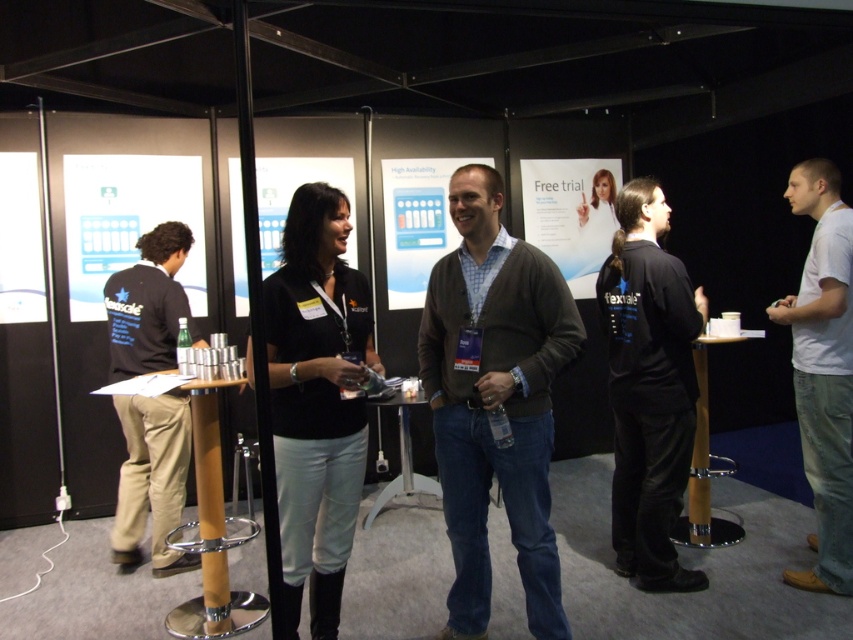
Based on the photo, which is more to the right, matte brown cardigan at center or white cotton shirt at right?

white cotton shirt at right

Can you confirm if matte brown cardigan at center is wider than white cotton shirt at right?

Yes, matte brown cardigan at center is wider than white cotton shirt at right.

Which is behind, point (521, 544) or point (831, 289)?

Point (831, 289)

This screenshot has width=853, height=640. Identify the location of matte brown cardigan at center. (x=495, y=401).

What do you see at coordinates (648, 388) in the screenshot? I see `black fabric shirt at center` at bounding box center [648, 388].

Between black fabric shirt at center and khaki cotton pants at left, which one is positioned higher?

black fabric shirt at center is higher up.

Does point (598, 284) lie behind point (117, 522)?

No, (598, 284) is closer to viewer.

This screenshot has height=640, width=853. In order to click on black fabric shirt at center in this screenshot , I will do `click(648, 388)`.

Who is more forward, (836, 484) or (196, 556)?

Point (836, 484)

I want to click on white cotton shirt at right, so click(822, 371).